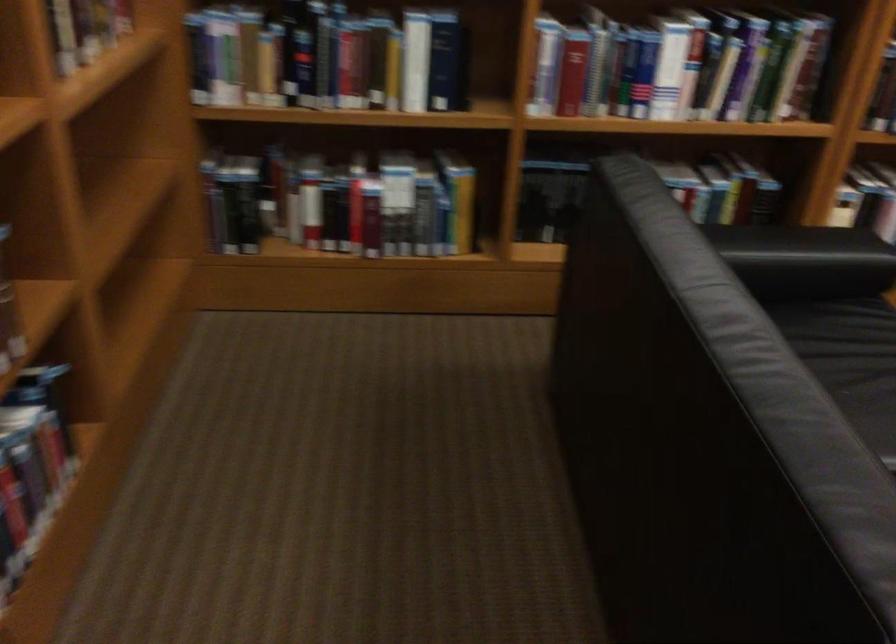
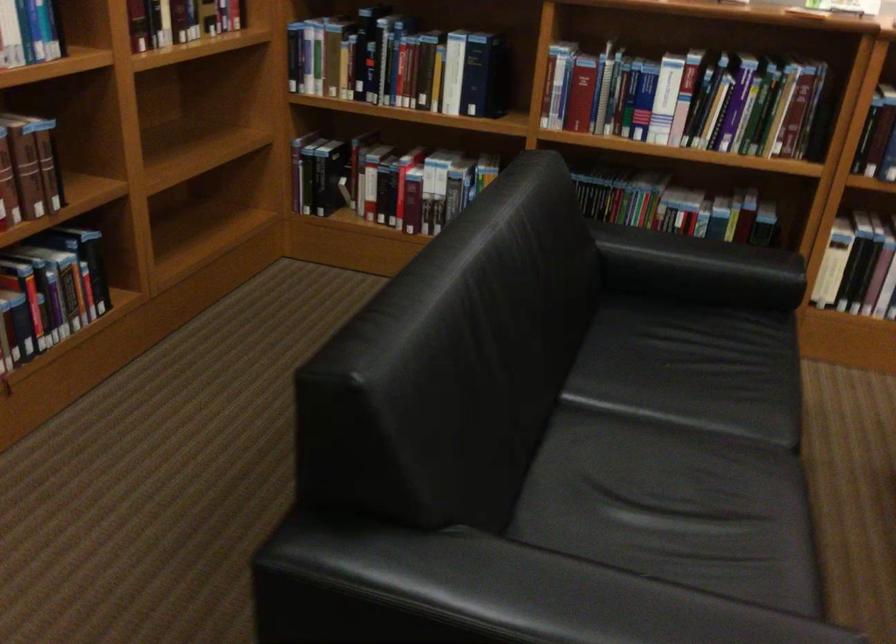
Find the pixel in the second image that matches point (698, 69) in the first image.

(688, 100)